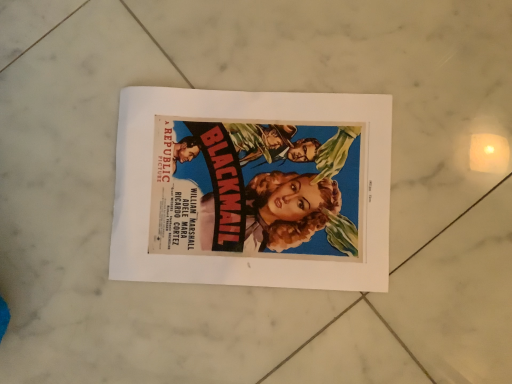
Identify the location of free space above matte paper poster at center (from a real-world perspective). (249, 190).